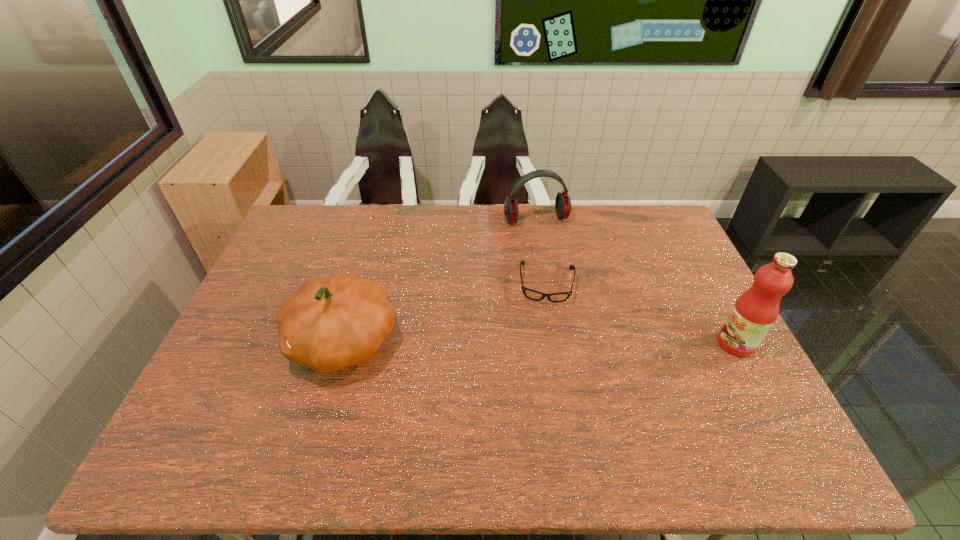
Identify the location of the leftmost object. This screenshot has width=960, height=540. (330, 323).

Where is `the tallest object`? This screenshot has height=540, width=960. the tallest object is located at coordinates (754, 312).

Locate an element on the screen. Image resolution: width=960 pixels, height=540 pixels. fruit juice is located at coordinates (754, 312).

This screenshot has width=960, height=540. I want to click on the third tallest object, so click(562, 203).

Where is `the farthest object`? the farthest object is located at coordinates (562, 203).

Where is `the shortest object`? The height and width of the screenshot is (540, 960). the shortest object is located at coordinates (531, 294).

Where is `vacant area situated 0.110m on the front face of the leftmost object`? vacant area situated 0.110m on the front face of the leftmost object is located at coordinates (247, 341).

You are a GUI agent. You are given a task and a screenshot of the screen. Output one action in this format:
    pyautogui.click(x=<x>, y=<y>)
    Task: Click on the vacant space located on the front label of the tallest object
    
    Given the screenshot: What is the action you would take?
    pyautogui.click(x=681, y=344)

At what (x,y) coordinates should I click in order to perform the action: click on vacant area situated on the front label of the tallest object. Please return your answer as a coordinate pair (x, y). The height and width of the screenshot is (540, 960). Looking at the image, I should click on (599, 344).

Where is `vacant space located on the front label of the tallest object`? Image resolution: width=960 pixels, height=540 pixels. vacant space located on the front label of the tallest object is located at coordinates (588, 344).